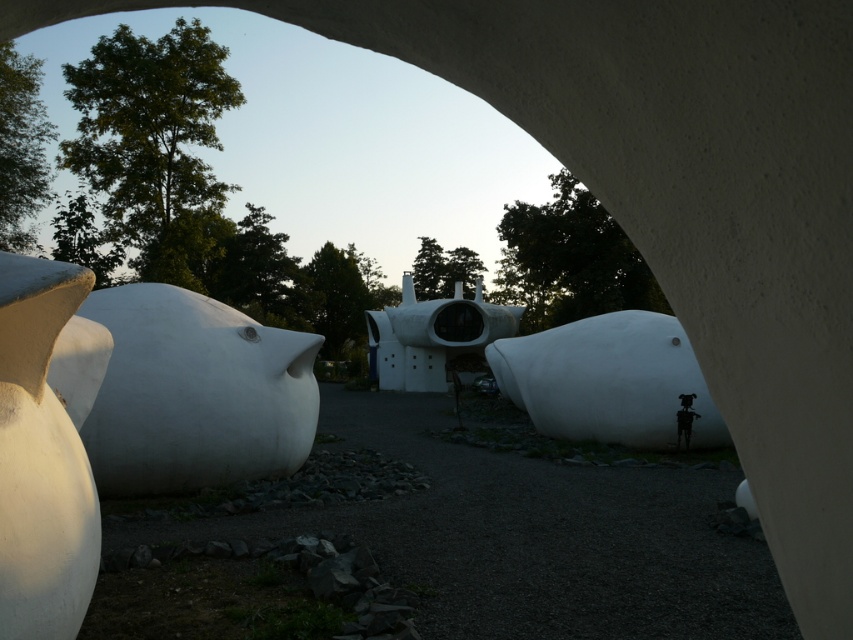
Between point (9, 467) and point (575, 371), which one is positioned behind?

The point (575, 371) is more distant.

Between point (74, 429) and point (625, 385), which one is positioned behind?

Positioned behind is point (625, 385).

The image size is (853, 640). Identify the location of white matte sculpture at left. 41,460.

At what (x,y) coordinates should I click in order to perform the action: click on white matte fish at left. Please return your answer as a coordinate pair (x, y). Looking at the image, I should click on (183, 390).

Measure the distance between point (300,436) and camera.

26.95 feet

Which is in front, point (90, 403) or point (393, 362)?

Point (90, 403) is in front.

The width and height of the screenshot is (853, 640). I want to click on white matte fish at left, so click(183, 390).

Is point (178, 419) farther from viewer compared to point (39, 282)?

Yes, point (178, 419) is behind point (39, 282).

Is white matte fish at left wider than white matte sculpture at left?

Yes, white matte fish at left is wider than white matte sculpture at left.

At what (x,y) coordinates should I click in order to perform the action: click on white matte fish at left. Please return your answer as a coordinate pair (x, y). The height and width of the screenshot is (640, 853). Looking at the image, I should click on (183, 390).